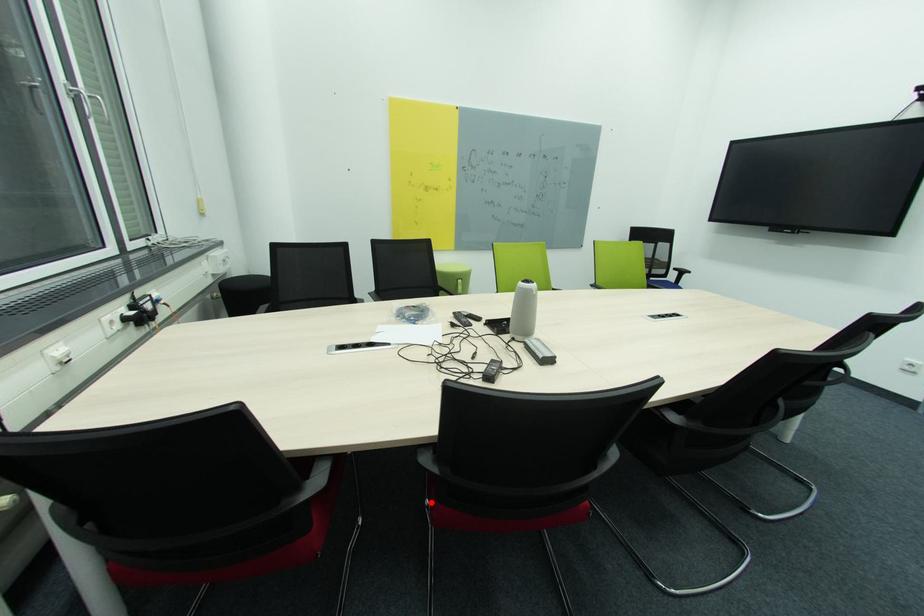
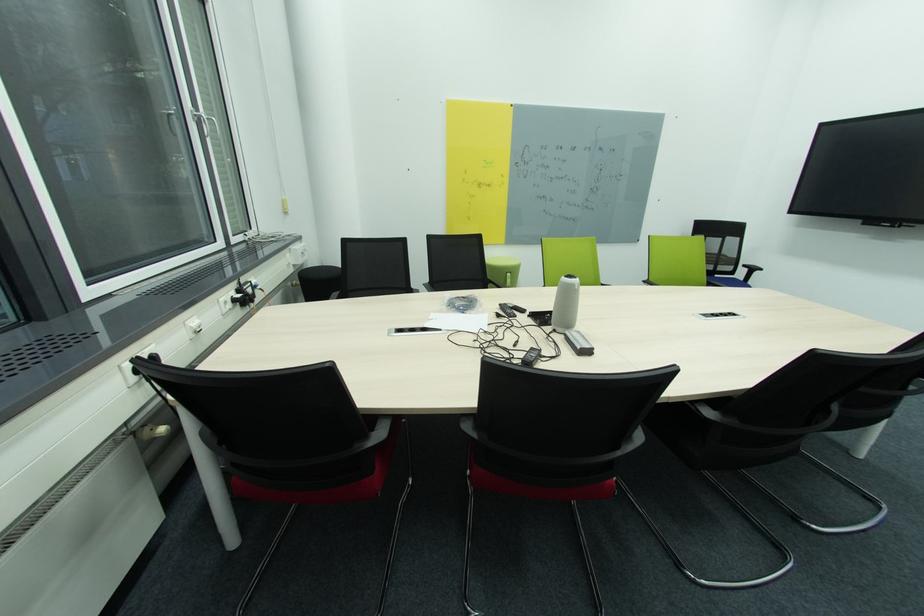
Find the pixel in the second image that matches the highlighted location in the first image.

(473, 474)